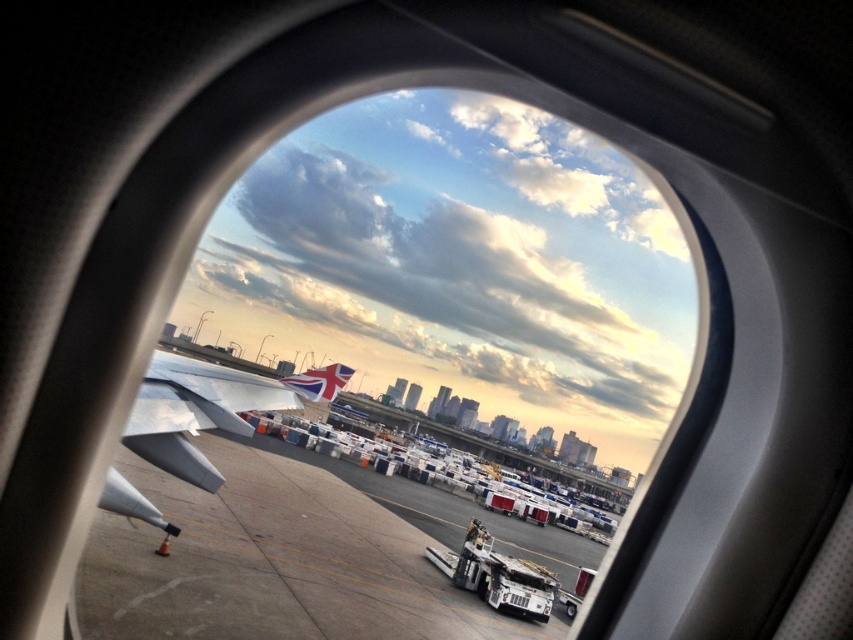
Who is lower down, concrete tarmac at center or silver metallic wing at lower left?

→ concrete tarmac at center

Is concrete tarmac at center thinner than silver metallic wing at lower left?

Incorrect, concrete tarmac at center's width is not less than silver metallic wing at lower left's.

The height and width of the screenshot is (640, 853). I want to click on concrete tarmac at center, so click(300, 556).